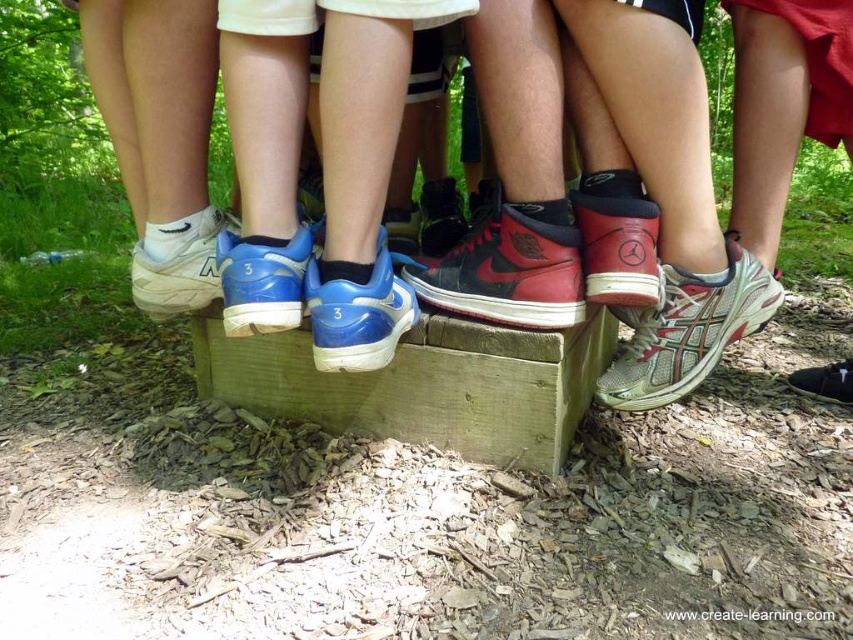
Is white mesh sneaker at center above black leather shoe at lower right?

Yes.

Is white mesh sneaker at center taller than black leather shoe at lower right?

Yes, white mesh sneaker at center is taller than black leather shoe at lower right.

Where is `white mesh sneaker at center`? The image size is (853, 640). white mesh sneaker at center is located at coordinates (180, 269).

Image resolution: width=853 pixels, height=640 pixels. In order to click on white mesh sneaker at center in this screenshot , I will do `click(180, 269)`.

Which is in front, point (775, 305) or point (601, 221)?

Positioned in front is point (601, 221).

Does tan mesh running shoe at center have a greater height compared to shiny red leather sneaker at center?

Yes.

Does point (625, 387) come closer to viewer compared to point (596, 248)?

No, it is not.

I want to click on tan mesh running shoe at center, so click(x=688, y=330).

Can you confirm if shiny red leather sneaker at center is shorter than shiny black sneaker at center?

In fact, shiny red leather sneaker at center may be taller than shiny black sneaker at center.

Which is more to the left, shiny red leather sneaker at center or shiny black sneaker at center?

shiny black sneaker at center is more to the left.

Is point (604, 236) farther from viewer compared to point (453, 198)?

No.

Find the location of a particular element. This screenshot has height=640, width=853. shiny red leather sneaker at center is located at coordinates (618, 240).